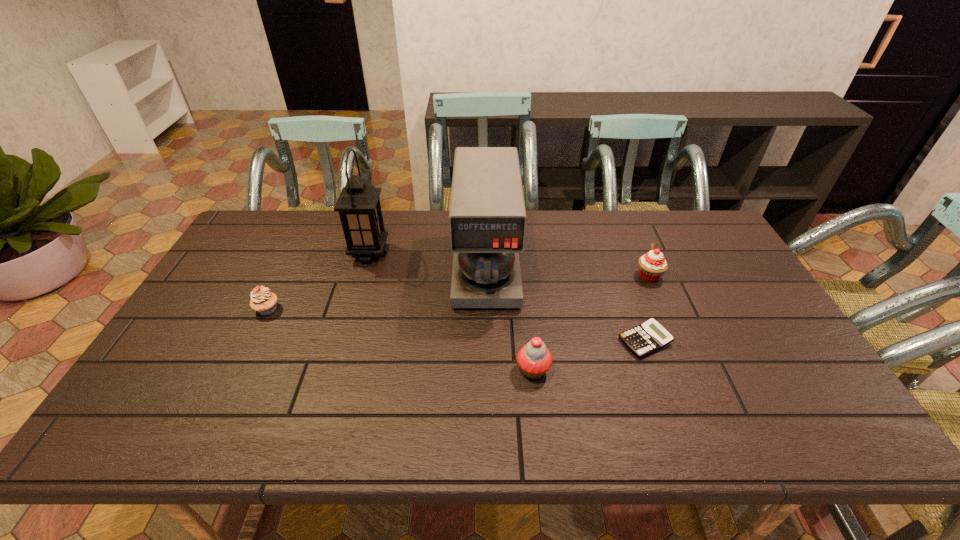
In the image, there is a desktop. At what (x,y) coordinates should I click in order to perform the action: click on vacant region at the far right corner. Please return your answer as a coordinate pair (x, y). The height and width of the screenshot is (540, 960). Looking at the image, I should click on (716, 249).

Where is `free area in between the lantern and the second cupcake from right to left`? free area in between the lantern and the second cupcake from right to left is located at coordinates (451, 312).

Find the location of `free spot between the shortest object and the second cupcake from right to left`. free spot between the shortest object and the second cupcake from right to left is located at coordinates point(588,355).

Locate an element on the screen. This screenshot has height=540, width=960. empty space that is in between the leftmost cupcake and the second object from left to right is located at coordinates (319, 281).

Where is `vacant region between the fifth object from right to left and the coffee maker`? vacant region between the fifth object from right to left and the coffee maker is located at coordinates (428, 260).

This screenshot has width=960, height=540. I want to click on vacant space that is in between the second shortest object and the nearest cupcake, so click(x=400, y=340).

Locate an element on the screen. Image resolution: width=960 pixels, height=540 pixels. vacant region between the nearest cupcake and the leftmost cupcake is located at coordinates (400, 340).

Identify the location of free space between the coffee maker and the nearest cupcake. (510, 319).

Locate an element on the screen. This screenshot has width=960, height=540. the fourth closest object relative to the second shortest object is located at coordinates (650, 336).

Locate an element on the screen. Image resolution: width=960 pixels, height=540 pixels. object that ranks as the fourth closest to the second cupcake from left to right is located at coordinates (359, 208).